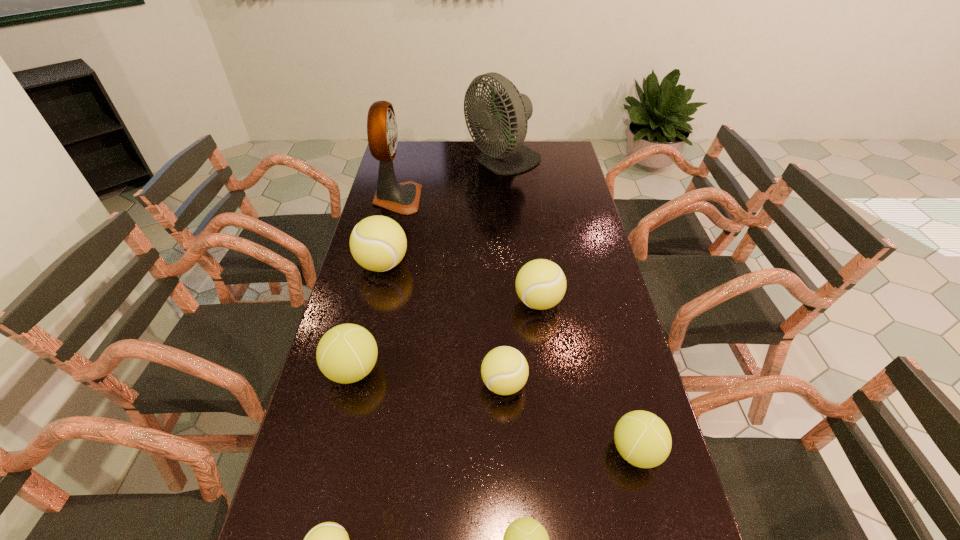
Locate an element on the screen. Image resolution: width=960 pixels, height=540 pixels. gray fan is located at coordinates (509, 108).

The height and width of the screenshot is (540, 960). I want to click on the left fan, so click(x=403, y=198).

You are a GUI agent. You are given a task and a screenshot of the screen. Output one action in this format:
    pyautogui.click(x=<x>, y=<y>)
    Task: Click on the tallest tennis ball
    Image resolution: width=960 pixels, height=540 pixels.
    Given the screenshot: What is the action you would take?
    pyautogui.click(x=378, y=243)

Locate an element on the screen. This screenshot has width=960, height=540. the farthest yellow tennis ball is located at coordinates (378, 243).

You are a GUI agent. You are given a task and a screenshot of the screen. Output one action in this format:
    pyautogui.click(x=<x>, y=<y>)
    Task: Click on the second farthest yellow tennis ball
    Image resolution: width=960 pixels, height=540 pixels.
    Given the screenshot: What is the action you would take?
    pyautogui.click(x=540, y=284)

Identify the location of the sixth nearest tennis ball. (540, 284).

Locate an element on the screen. This screenshot has width=960, height=540. the biggest green tennis ball is located at coordinates (347, 353).

Locate an element on the screen. Image resolution: width=960 pixels, height=540 pixels. the leftmost green tennis ball is located at coordinates (347, 353).

At what (x,y) coordinates should I click in order to perform the action: click on the second nearest yellow tennis ball. Please return your answer as a coordinate pair (x, y). Image resolution: width=960 pixels, height=540 pixels. Looking at the image, I should click on (504, 370).

Find the location of `the second farthest green tennis ball`. the second farthest green tennis ball is located at coordinates (643, 439).